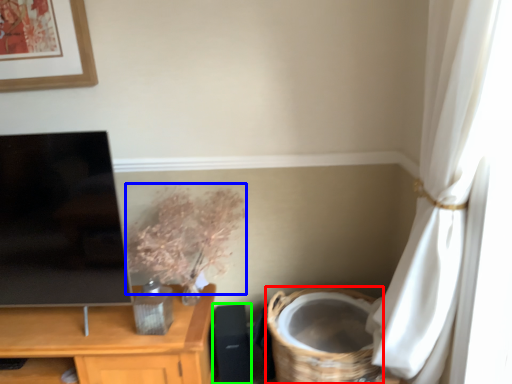
Question: Which is farther away from basket (highlighted by a red box)? floral arrangement (highlighted by a blue box) or speaker (highlighted by a green box)?

Choices:
 (A) floral arrangement
 (B) speaker

Answer: (A)